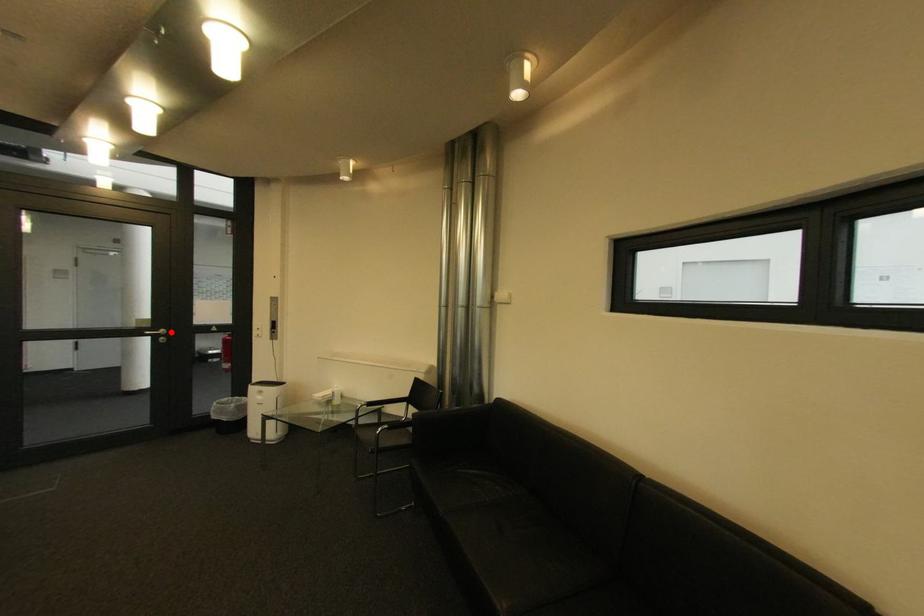
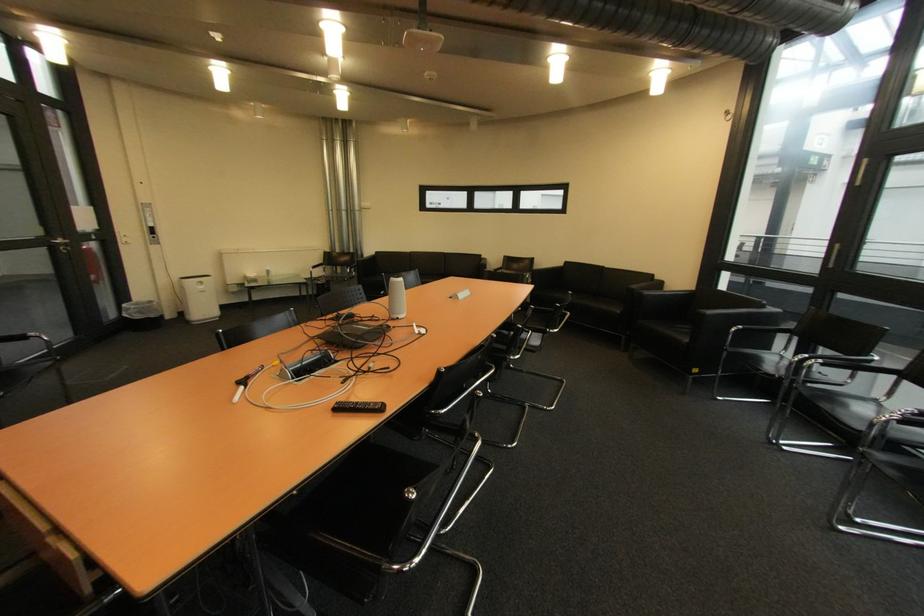
Question: I am providing you with two images of the same scene from different viewpoints. A red point is marked on the first image. Is the red point's position out of view in image 2?

Choices:
 (A) Yes
 (B) No

Answer: (B)